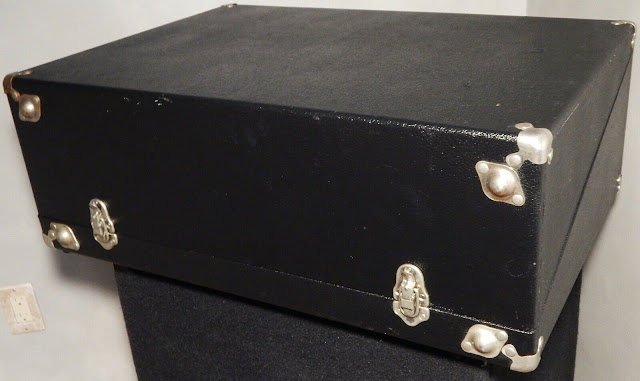
The image size is (640, 381). In order to click on wall in this screenshot , I will do click(65, 16).